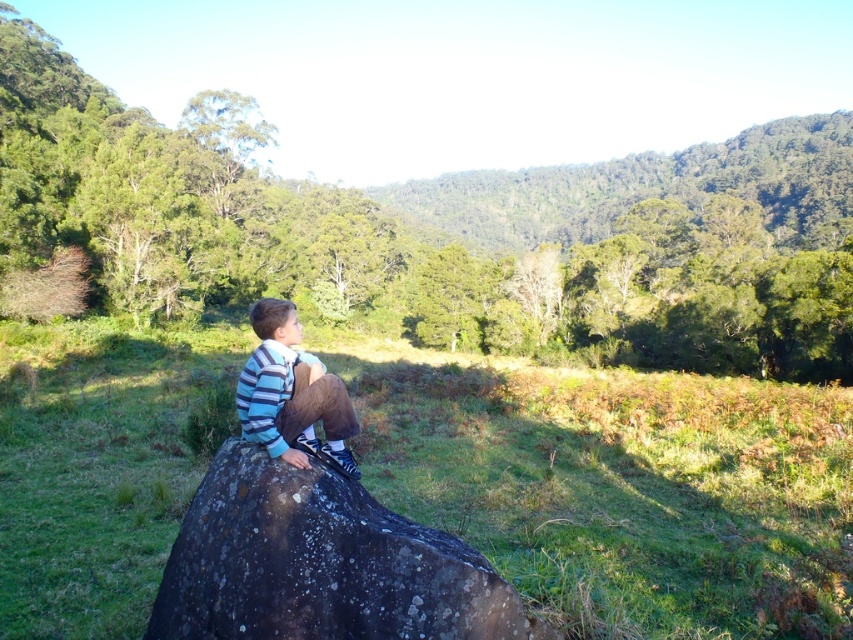
You are a photographer planning to take a picture of the speckled dark rock at center and the striped cotton shirt at center. You need to ensure both are in focus. If your camera has a depth of field that can cover up to 25 inches, will both objects be in focus?

The distance between the speckled dark rock at center and the striped cotton shirt at center is 26.80 inches, which exceeds the camera depth of field of 25 inches. Therefore, both objects cannot be in focus simultaneously.

You are standing at the origin point in the grassy field and want to move towards the speckled dark rock at center. Which direction should you head? The speckled dark rock at center is located at point (318, 563) in the image coordinate system. Please provide your answer in terms of direction relative to the image coordinate system. The image coordinate system has the origin at the bottom left corner, with x increasing to the right and y increasing upwards. The answer should be in the format of a vector,

The speckled dark rock at center is located at point (318, 563) in the image coordinate system. To reach it from the origin, you should move in the direction of the vector pointing to (318, 563). Since the x coordinate is 0.881 and y is 0.374, the direction vector would be approximately 0.881 in the positive x direction and 0.374 in the positive y direction. Therefore, the direction vector is approximately <(318, 563)>.

You are a photographer trying to capture the speckled dark rock at center and the striped cotton shirt at center in a single shot. Which object should you focus on first to ensure both are in sharp focus?

You should focus on the speckled dark rock at center first because it is closer to the viewer than the striped cotton shirt at center, ensuring both will be in focus when using depth of field properly.